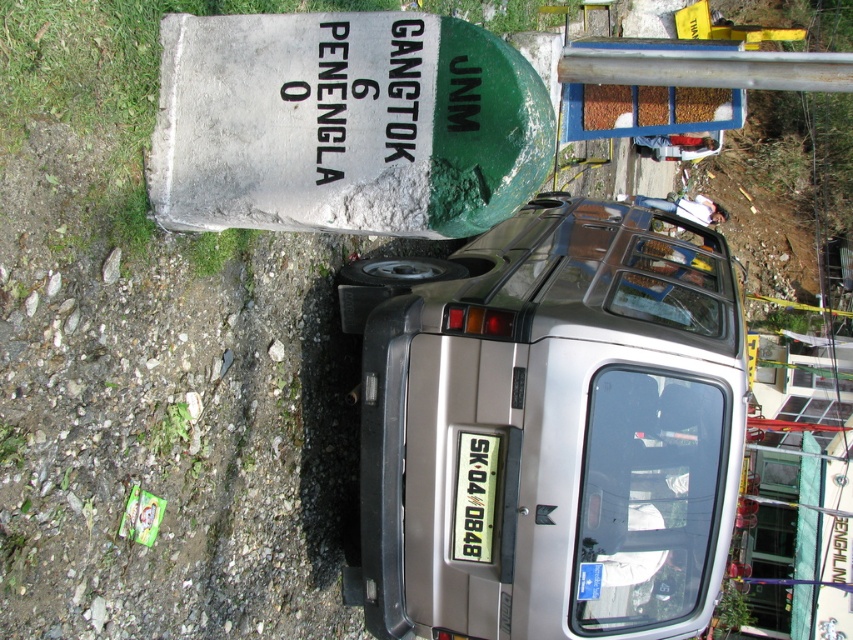
You are a driver who just arrived at this location. You need to park your car so that the license plate is visible to other drivers passing by. Given the satin silver minivan at center and the white plastic license plate at center, which object should you position closer to the road to ensure visibility?

The white plastic license plate at center should be positioned closer to the road since it is smaller than the satin silver minivan at center, allowing it to be more easily seen by passing drivers.